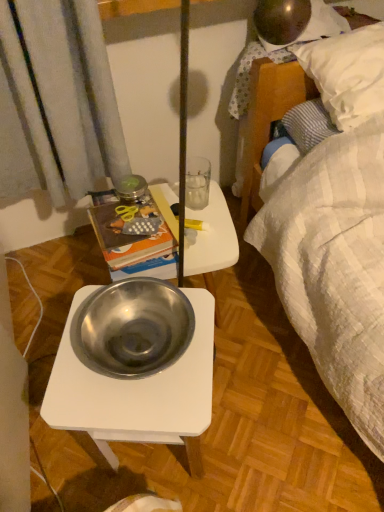
At what (x,y) coordinates should I click in order to perform the action: click on free spot above polished stainless steel bowl at center (from a real-world perspective). Please return your answer as a coordinate pair (x, y). The width and height of the screenshot is (384, 512). Looking at the image, I should click on (142, 354).